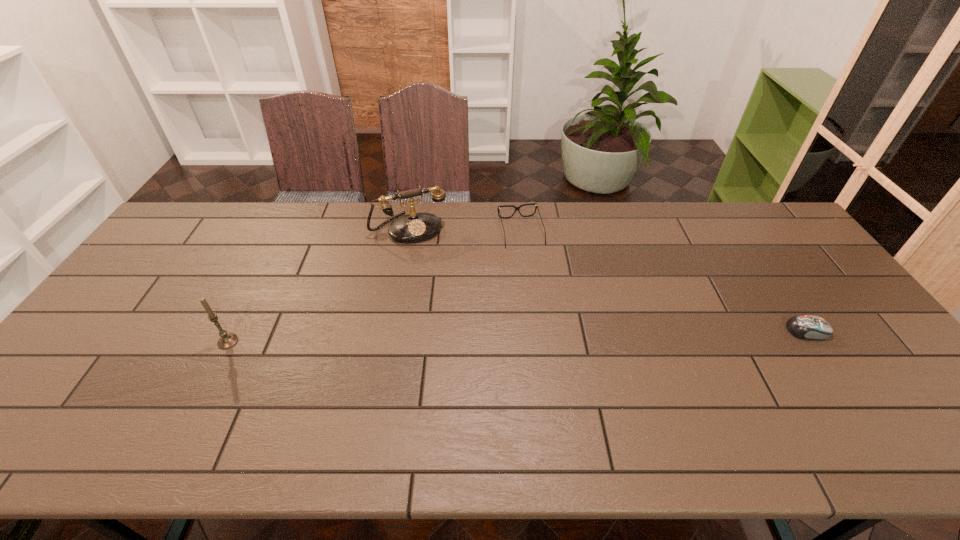
In order to click on vacant area located 0.250m on the dial of the second object from left to right in this screenshot , I will do `click(444, 296)`.

Where is `free space located with the lenses facing outward on the spectacles`? The width and height of the screenshot is (960, 540). free space located with the lenses facing outward on the spectacles is located at coordinates (545, 314).

This screenshot has height=540, width=960. What are the coordinates of `vacant area located 0.200m with the lenses facing outward on the spectacles` in the screenshot? It's located at (540, 294).

At what (x,y) coordinates should I click in order to perform the action: click on blank area located with the lenses facing outward on the spectacles. Please return your answer as a coordinate pair (x, y). This screenshot has width=960, height=540. Looking at the image, I should click on (536, 281).

Find the location of `telephone located in the far edge section of the desktop`. telephone located in the far edge section of the desktop is located at coordinates (415, 227).

At what (x,y) coordinates should I click in order to perform the action: click on spectacles located at the far edge. Please return your answer as a coordinate pair (x, y). The width and height of the screenshot is (960, 540). Looking at the image, I should click on (536, 207).

You are a GUI agent. You are given a task and a screenshot of the screen. Output one action in this format:
    pyautogui.click(x=<x>, y=<y>)
    Task: Click on the object located in the right edge section of the desktop
    
    Given the screenshot: What is the action you would take?
    pyautogui.click(x=812, y=327)

The width and height of the screenshot is (960, 540). Find the location of `vacant space at the far edge of the desktop`. vacant space at the far edge of the desktop is located at coordinates (597, 218).

Identify the location of vacant area at the near edge. (396, 411).

This screenshot has height=540, width=960. Find the location of `vacant space at the left edge of the desktop`. vacant space at the left edge of the desktop is located at coordinates (150, 322).